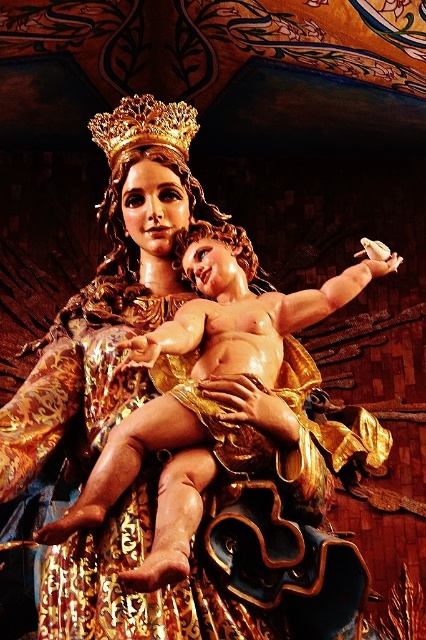
Question: Which of the following is the closest to the observer?

Choices:
 (A) smooth gold baby at center
 (B) gold metallic crown at upper center

Answer: (A)

Question: Does smooth gold baby at center lie behind gold metallic crown at upper center?

Choices:
 (A) no
 (B) yes

Answer: (A)

Question: Can you confirm if smooth gold baby at center is positioned above gold metallic crown at upper center?

Choices:
 (A) yes
 (B) no

Answer: (B)

Question: Does smooth gold baby at center come in front of gold metallic crown at upper center?

Choices:
 (A) yes
 (B) no

Answer: (A)

Question: Which point appears farthest from the camera in this image?

Choices:
 (A) (114, 138)
 (B) (229, 342)

Answer: (A)